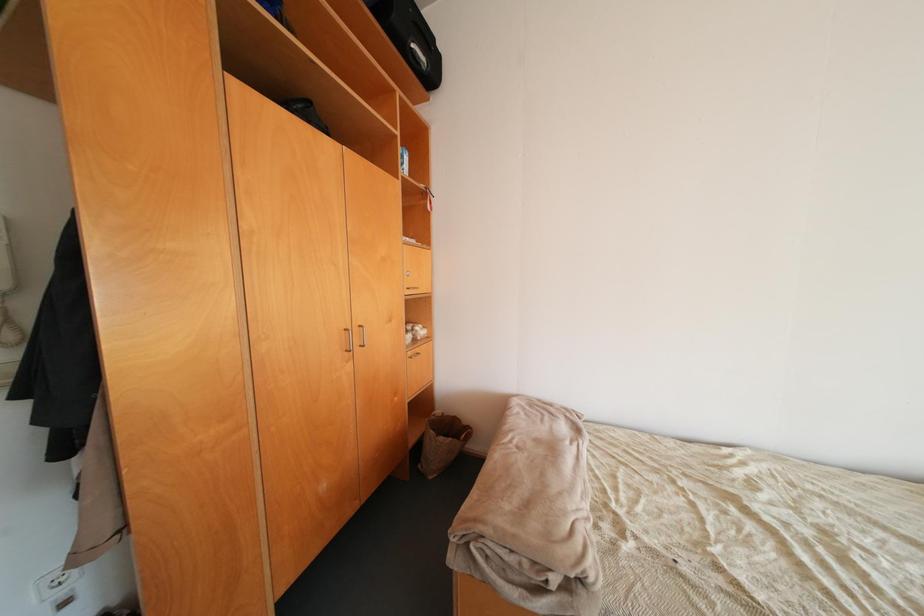
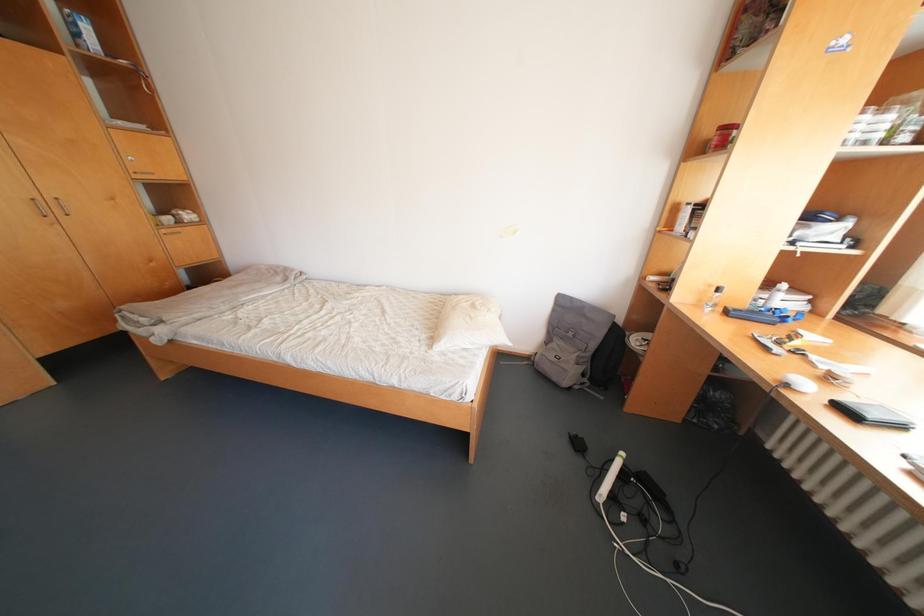
What movement of the cameraman would produce the second image?

The movement direction of the cameraman is right, backward.